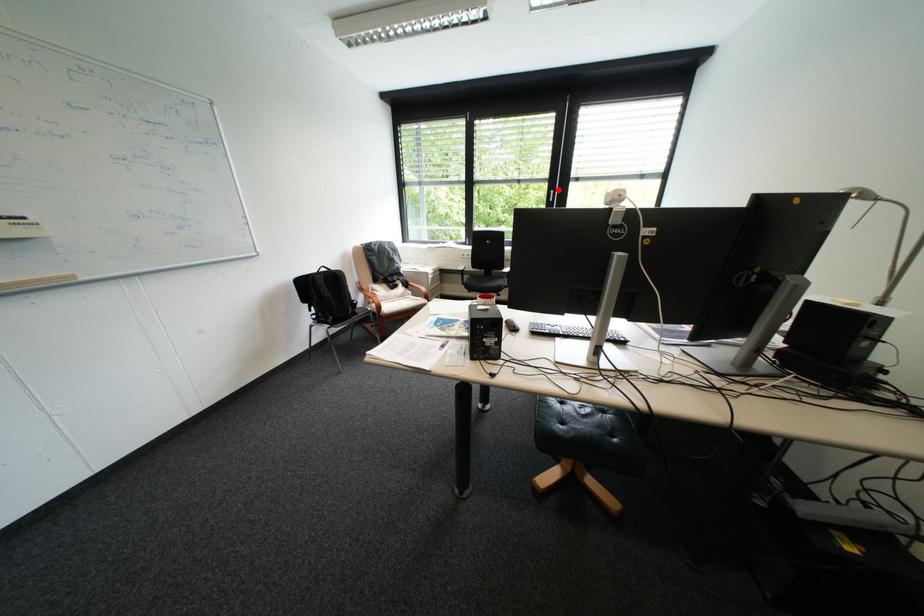
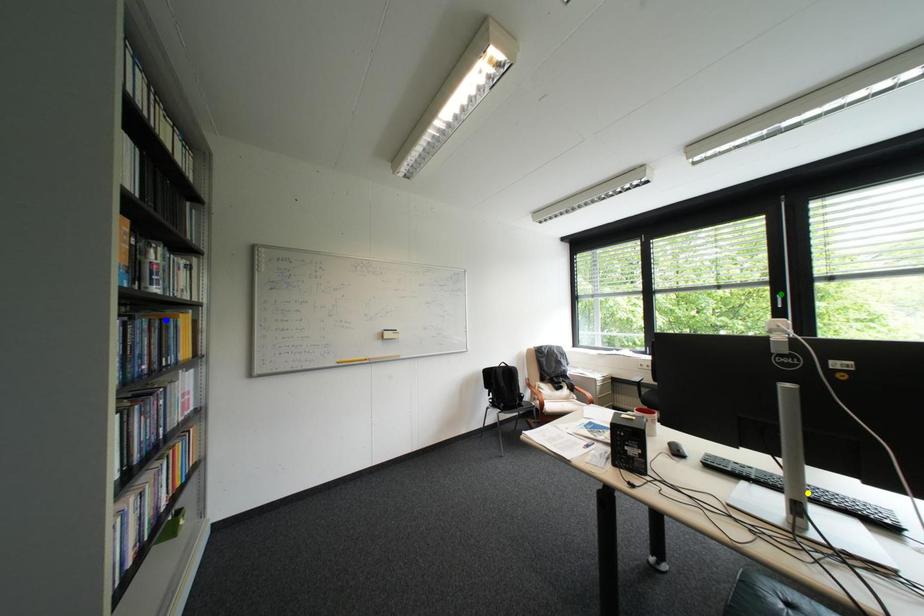
Question: I am providing you with two images of the same scene from different viewpoints. A red point is marked on the first image. You are given multiple points on the second image. In image 2, which mark is for the same physical point as the one in image 1?

Choices:
 (A) blue point
 (B) yellow point
 (C) green point

Answer: (C)